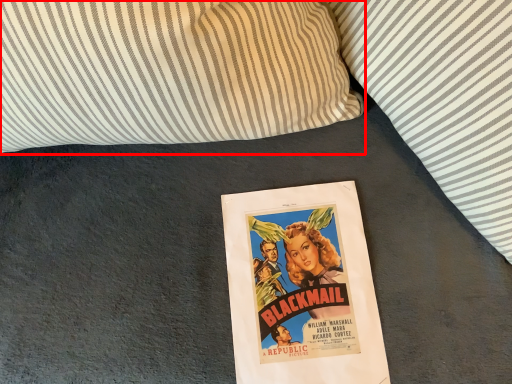
Question: From the image's perspective, what is the correct spatial relationship of pillow (annotated by the red box) in relation to pillow?

Choices:
 (A) above
 (B) below

Answer: (A)